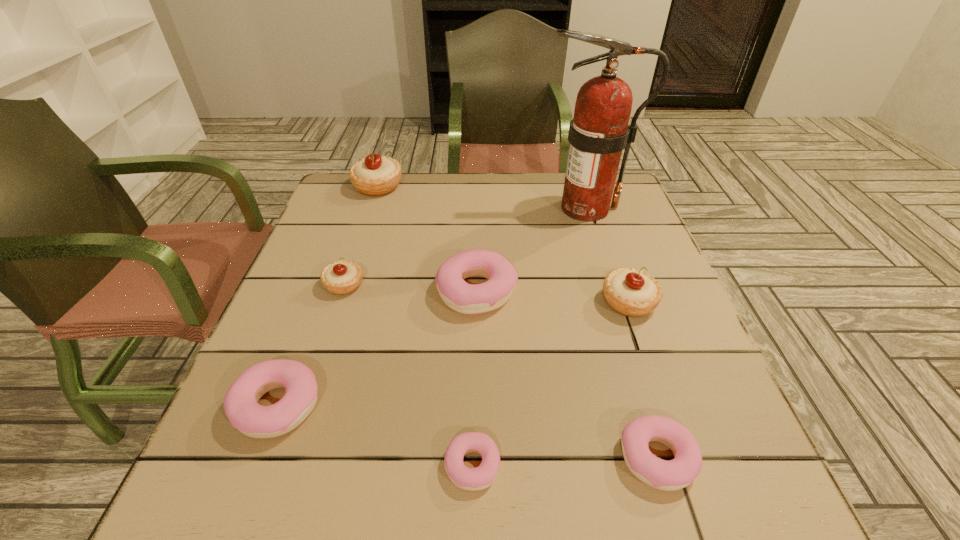
Identify which beige pastry is the second closest to the biggest pink pastry. Please provide its 2D coordinates. Your answer should be formatted as a tuple, i.e. [(x, y)], where the tuple contains the x and y coordinates of a point satisfying the conditions above.

[(631, 292)]

Identify which beige pastry is the second closest to the smallest beige pastry. Please provide its 2D coordinates. Your answer should be formatted as a tuple, i.e. [(x, y)], where the tuple contains the x and y coordinates of a point satisfying the conditions above.

[(631, 292)]

Identify the location of the third closest pink pastry relative to the rightmost pink pastry. This screenshot has height=540, width=960. (241, 406).

At what (x,y) coordinates should I click in order to perform the action: click on pink pastry that stands as the closest to the second shortest object. Please return your answer as a coordinate pair (x, y). The image size is (960, 540). Looking at the image, I should click on (473, 479).

At what (x,y) coordinates should I click in order to perform the action: click on vacant position in the image that satisfies the following two spatial constraints: 1. on the front side of the leftmost pink pastry; 2. on the left side of the smallest pink pastry. Please return your answer as a coordinate pair (x, y). Looking at the image, I should click on (254, 465).

Locate an element on the screen. The image size is (960, 540). free spot that satisfies the following two spatial constraints: 1. at the nozzle of the fire extinguisher; 2. on the right side of the rightmost beige pastry is located at coordinates click(x=615, y=302).